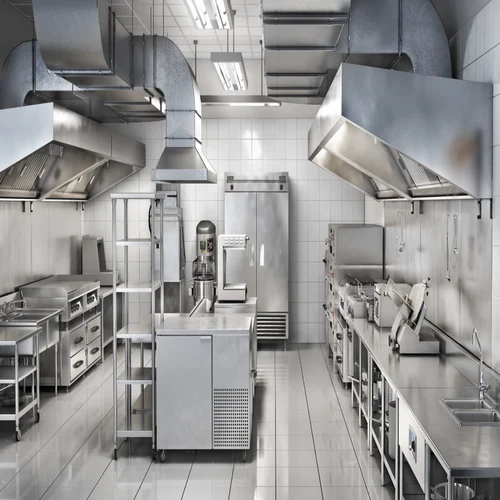
Find the location of a particular element. lights is located at coordinates (226, 19).